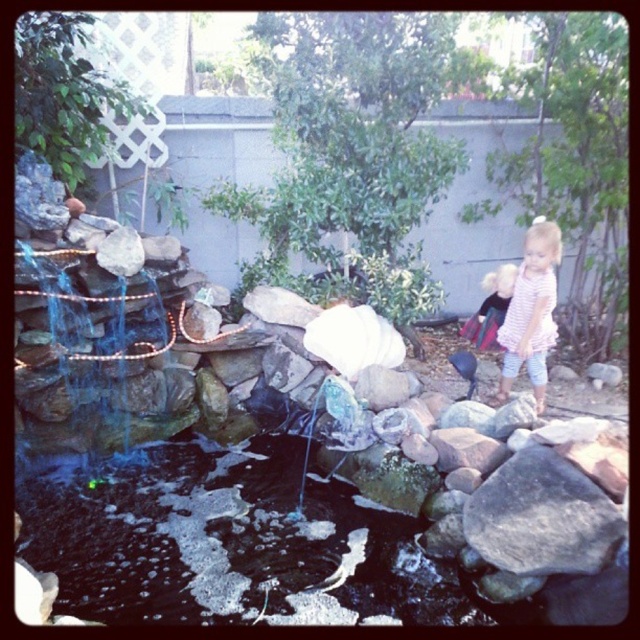
Question: Which of the following is the closest to the observer?

Choices:
 (A) pink cotton dress at center
 (B) blonde hair child at right
 (C) gray rough rock at lower right

Answer: (C)

Question: Can you confirm if gray rough rock at lower right is thinner than pink cotton dress at center?

Choices:
 (A) yes
 (B) no

Answer: (B)

Question: Does gray rough rock at lower right appear under blonde hair child at right?

Choices:
 (A) yes
 (B) no

Answer: (A)

Question: Among these objects, which one is farthest from the camera?

Choices:
 (A) gray rough rock at lower right
 (B) blonde hair child at right

Answer: (B)

Question: Which of the following is the closest to the observer?

Choices:
 (A) blonde hair child at right
 (B) gray rough rock at lower right
 (C) pink cotton dress at center
 (D) white matte rock at center

Answer: (B)

Question: Is pink cotton dress at center below blonde hair child at right?

Choices:
 (A) yes
 (B) no

Answer: (A)